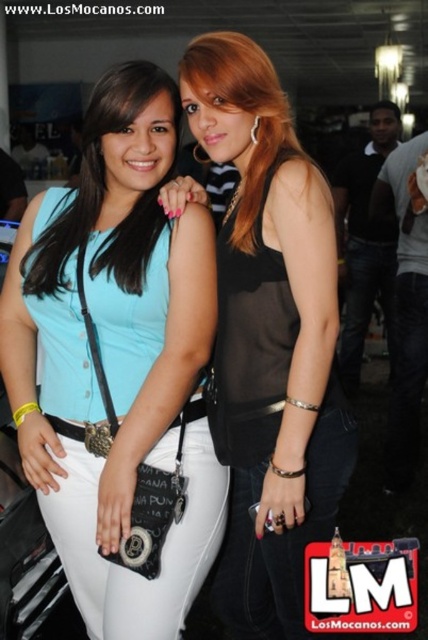
Who is taller, matte black top at center or black sheer top at center?

Standing taller between the two is black sheer top at center.

What do you see at coordinates (118, 368) in the screenshot? Image resolution: width=428 pixels, height=640 pixels. I see `matte black top at center` at bounding box center [118, 368].

Where is `matte black top at center`? This screenshot has height=640, width=428. matte black top at center is located at coordinates click(x=118, y=368).

Where is `matte black top at center`? The height and width of the screenshot is (640, 428). matte black top at center is located at coordinates (118, 368).